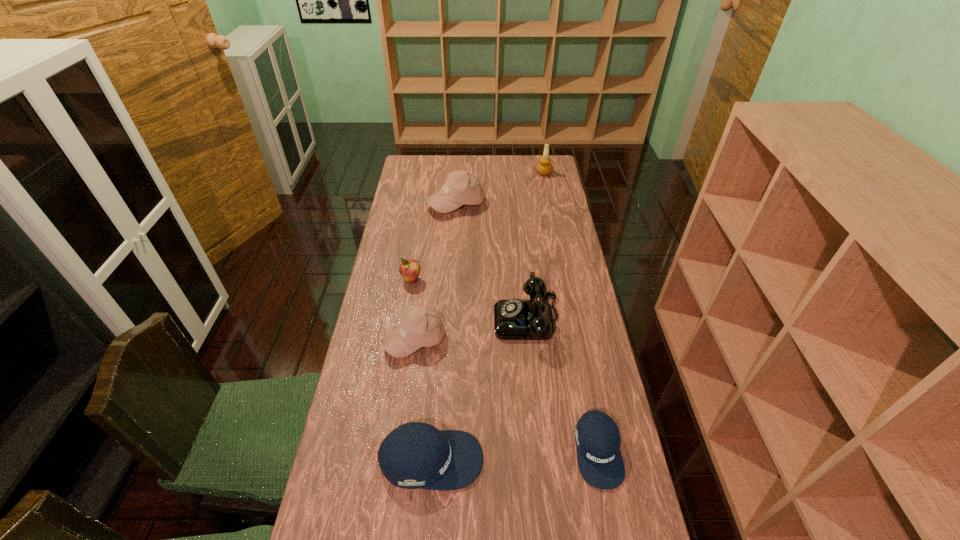
Find the location of a particular element. the farthest object is located at coordinates (544, 167).

The image size is (960, 540). I want to click on the farther pink baseball cap, so click(x=460, y=188).

Locate an element on the screen. The height and width of the screenshot is (540, 960). the farthest baseball cap is located at coordinates (460, 188).

Locate an element on the screen. black telephone is located at coordinates (514, 319).

Find the location of a particular element. The image size is (960, 540). the third farthest object is located at coordinates (409, 269).

At what (x,y) coordinates should I click in order to perform the action: click on red apple. Please return your answer as a coordinate pair (x, y). This screenshot has height=540, width=960. Looking at the image, I should click on (409, 269).

Where is `the nearer pink baseball cap`? the nearer pink baseball cap is located at coordinates (420, 328).

The width and height of the screenshot is (960, 540). Find the location of `the smaller pink baseball cap`. the smaller pink baseball cap is located at coordinates (420, 328).

This screenshot has width=960, height=540. Find the location of `the left blue baseball cap`. the left blue baseball cap is located at coordinates (414, 455).

Find the location of `the shortest object`. the shortest object is located at coordinates (597, 437).